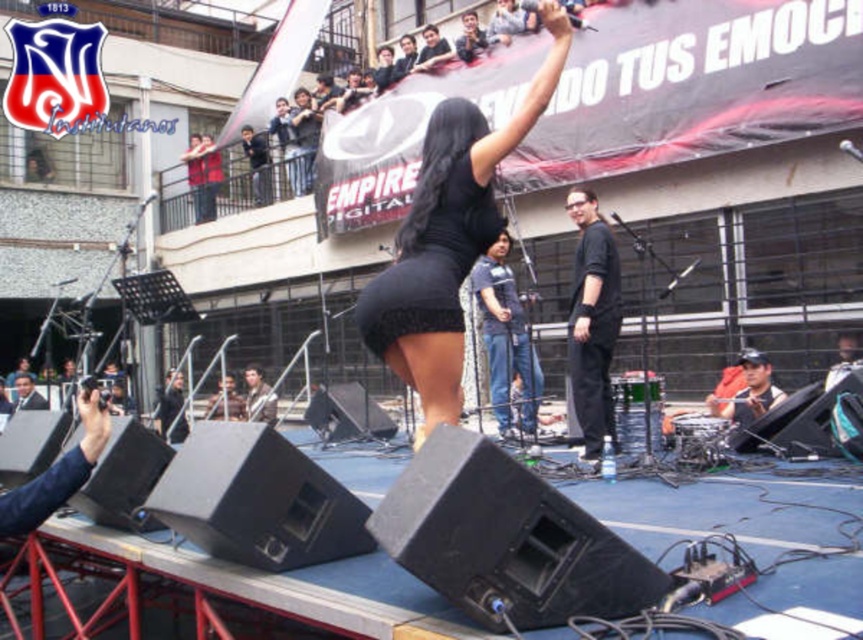
What are the coordinates of `black matte pants at center` in the screenshot? It's located at (591, 323).

Who is lower down, black matte pants at center or dark blue baseball cap at lower right?

dark blue baseball cap at lower right is below.

Where is `black matte pants at center`? Image resolution: width=863 pixels, height=640 pixels. black matte pants at center is located at coordinates (591, 323).

From the picture: Is black matte shorts at center bigger than dark blue baseball cap at lower right?

Indeed, black matte shorts at center has a larger size compared to dark blue baseball cap at lower right.

Who is lower down, black matte shorts at center or dark blue baseball cap at lower right?

Positioned lower is dark blue baseball cap at lower right.

Describe the element at coordinates (505, 339) in the screenshot. The image size is (863, 640). I see `black matte shorts at center` at that location.

Find the location of a particular element. black matte shorts at center is located at coordinates (505, 339).

Does black matte skirt at center appear on the right side of black matte shorts at center?

No, black matte skirt at center is not to the right of black matte shorts at center.

Who is higher up, black matte skirt at center or black matte shorts at center?

Positioned higher is black matte skirt at center.

Is point (553, 3) positioned in front of point (489, 289)?

Yes.

You are a GUI agent. You are given a task and a screenshot of the screen. Output one action in this format:
    pyautogui.click(x=<x>, y=<y>)
    Task: Click on the black matte skirt at center
    The image size is (863, 640).
    Given the screenshot: What is the action you would take?
    pyautogui.click(x=449, y=237)